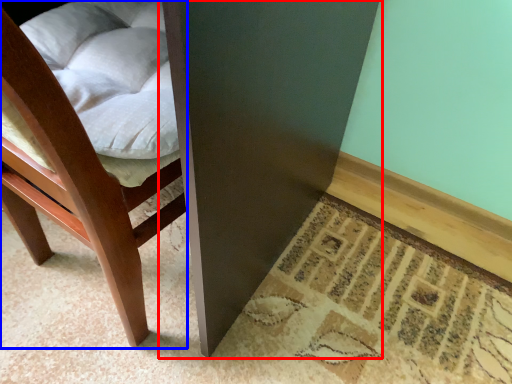
Question: Which object appears closest to the camera in this image, table (highlighted by a red box) or chair (highlighted by a blue box)?

Choices:
 (A) table
 (B) chair

Answer: (B)